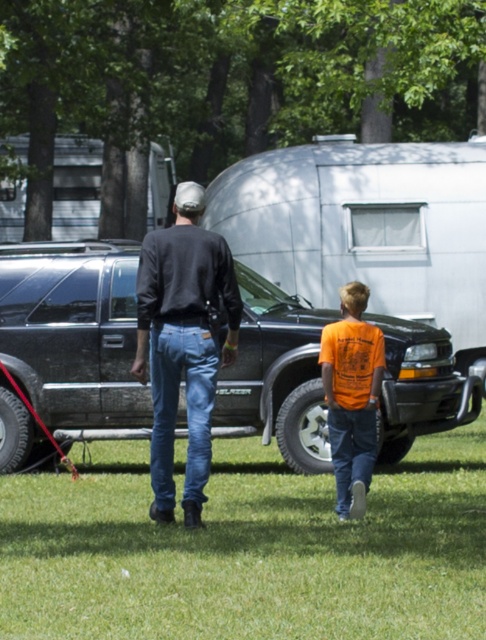
Who is more distant from viewer, (40,417) or (374,385)?

Positioned behind is point (40,417).

In the scene shown: Does black glossy truck at center have a lesser width compared to orange t-shirt at center?

No.

Describe the element at coordinates (74, 337) in the screenshot. I see `black glossy truck at center` at that location.

Where is `black glossy truck at center`? This screenshot has height=640, width=486. black glossy truck at center is located at coordinates (74, 337).

Is point (324, 196) positioned behind point (341, 298)?

Yes.

Between point (462, 301) and point (364, 413), which one is positioned in front?

Point (364, 413) is more forward.

Is point (393, 301) more distant than point (342, 285)?

No, it is in front of (342, 285).

In order to click on black glossy pickup truck at center in this screenshot , I will do tap(367, 228).

Is green grass at lower center to the left of orange t-shirt at center from the viewer's perspective?

Correct, you'll find green grass at lower center to the left of orange t-shirt at center.

How far apart are green grass at lower center and orange t-shirt at center?

green grass at lower center is 6.81 feet away from orange t-shirt at center.

Between point (399, 499) and point (350, 496), which one is positioned behind?

The point (399, 499) is more distant.

Find the location of `green grass at lower center`. green grass at lower center is located at coordinates (248, 548).